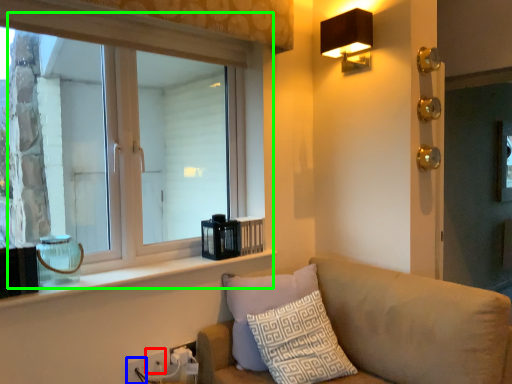
Question: Which object is positioned farthest from electric outlet (highlighted by a red box)? Select from electric outlet (highlighted by a blue box) and window (highlighted by a green box).

Choices:
 (A) electric outlet
 (B) window

Answer: (B)